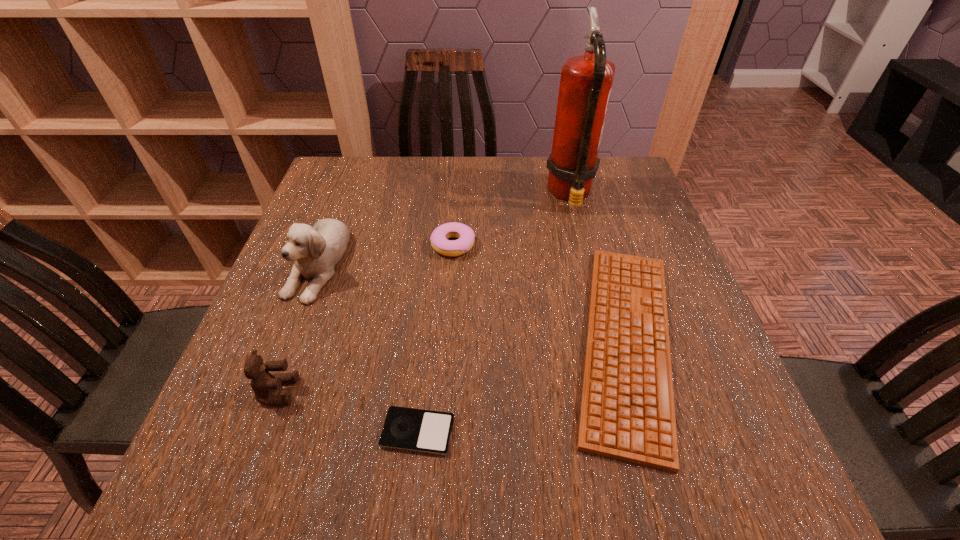
Locate an element on the screen. fire extinguisher that is at the right edge is located at coordinates (586, 80).

At what (x,y) coordinates should I click in order to perform the action: click on computer keyboard positioned at the right edge. Please return your answer as a coordinate pair (x, y). The height and width of the screenshot is (540, 960). Looking at the image, I should click on tap(627, 413).

Locate an element on the screen. The height and width of the screenshot is (540, 960). object that is at the far right corner is located at coordinates (586, 80).

At what (x,y) coordinates should I click in order to perform the action: click on object that is at the near right corner. Please return your answer as a coordinate pair (x, y). The image size is (960, 540). Looking at the image, I should click on (627, 413).

Locate an element on the screen. vacant space at the far edge of the desktop is located at coordinates (518, 162).

In the image, there is a desktop. Where is `vacant region at the near edge`? The height and width of the screenshot is (540, 960). vacant region at the near edge is located at coordinates (288, 501).

Image resolution: width=960 pixels, height=540 pixels. In the image, there is a desktop. Find the location of `vacant area at the left edge`. vacant area at the left edge is located at coordinates (330, 315).

Find the location of a particular element. Image resolution: width=960 pixels, height=540 pixels. vacant space at the right edge of the desktop is located at coordinates (693, 326).

In the image, there is a desktop. Where is `vacant space at the far left corner`? This screenshot has width=960, height=540. vacant space at the far left corner is located at coordinates (324, 192).

In order to click on vacant space at the far right corner in this screenshot , I will do `click(630, 171)`.